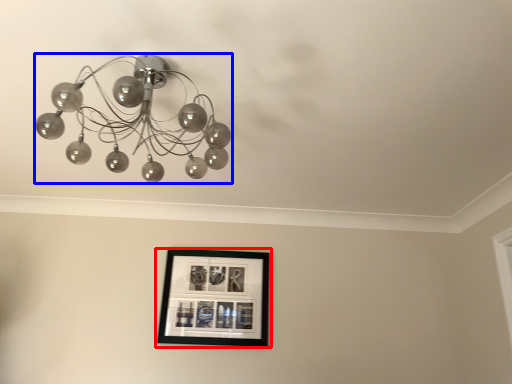
Question: Which object appears closest to the camera in this image, picture frame (highlighted by a red box) or lamp (highlighted by a blue box)?

Choices:
 (A) picture frame
 (B) lamp

Answer: (B)